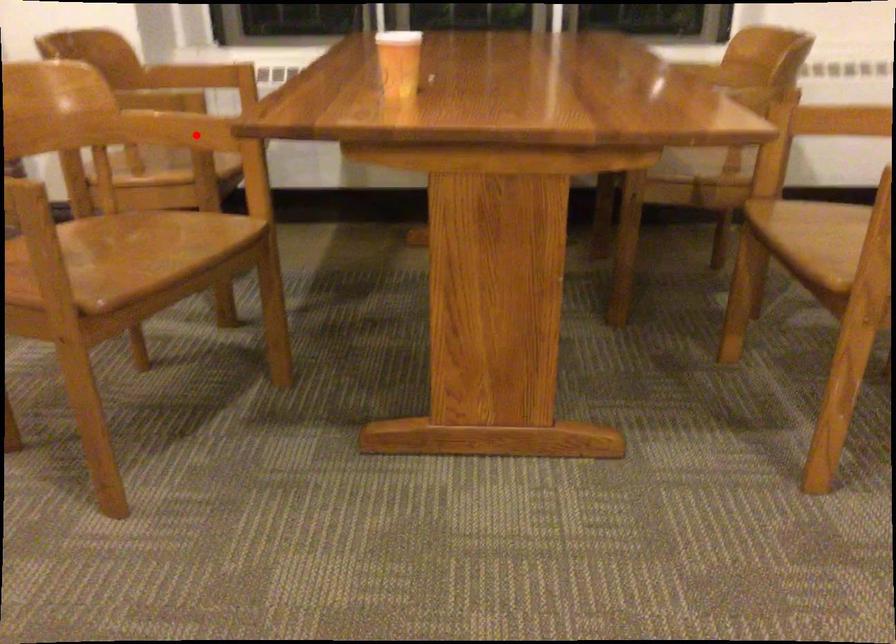
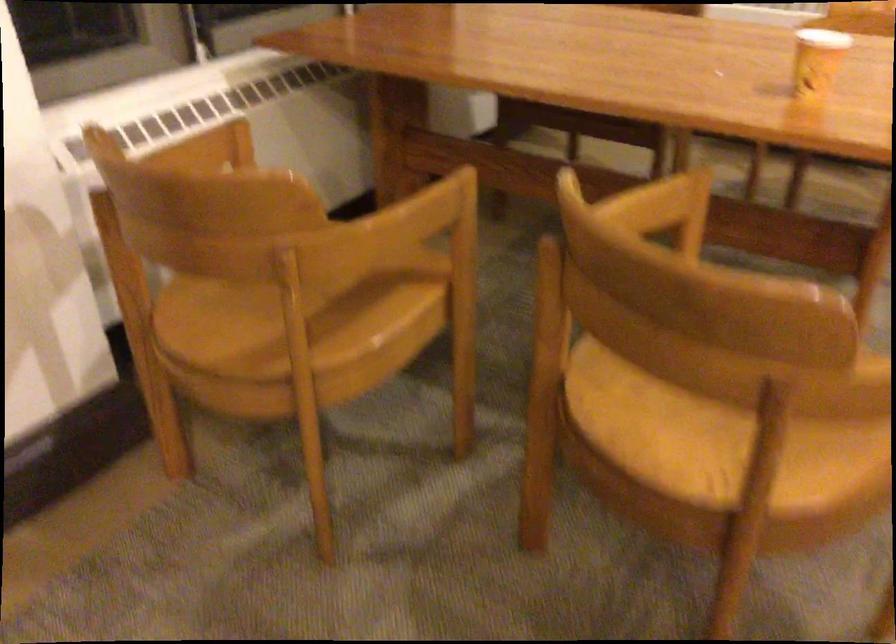
In the second image, find the point that corresponds to the highlighted location in the first image.

(650, 205)